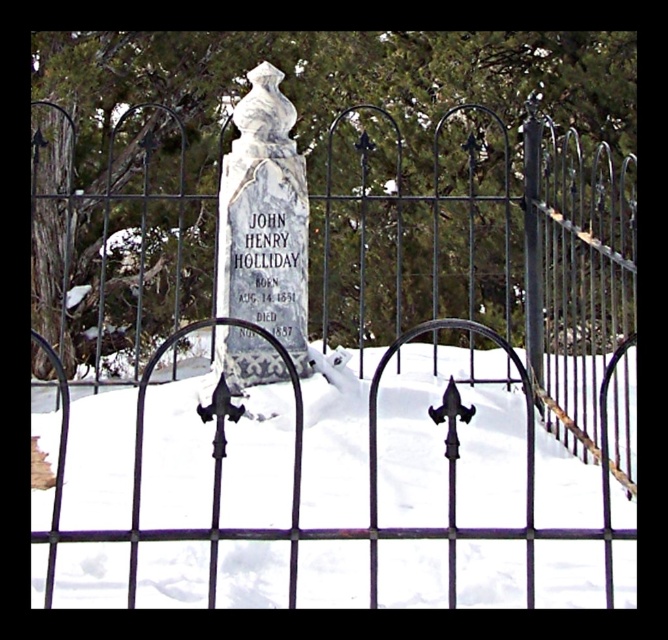
Can you confirm if black wrought iron gate at center is smaller than white marble gravestone at center?

No, black wrought iron gate at center is not smaller than white marble gravestone at center.

Where is `black wrought iron gate at center`? The width and height of the screenshot is (668, 640). black wrought iron gate at center is located at coordinates (301, 477).